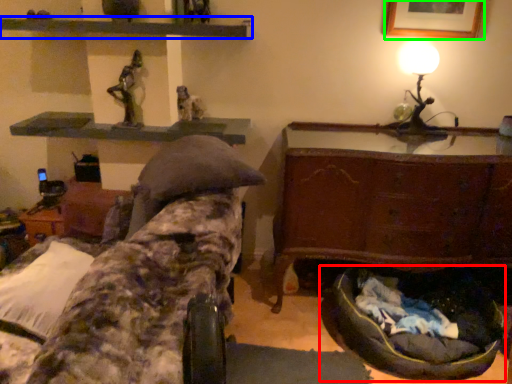
Question: Which is nearer to the bean bag chair (highlighted by a red box)? shelf (highlighted by a blue box) or picture frame (highlighted by a green box).

Choices:
 (A) shelf
 (B) picture frame

Answer: (B)